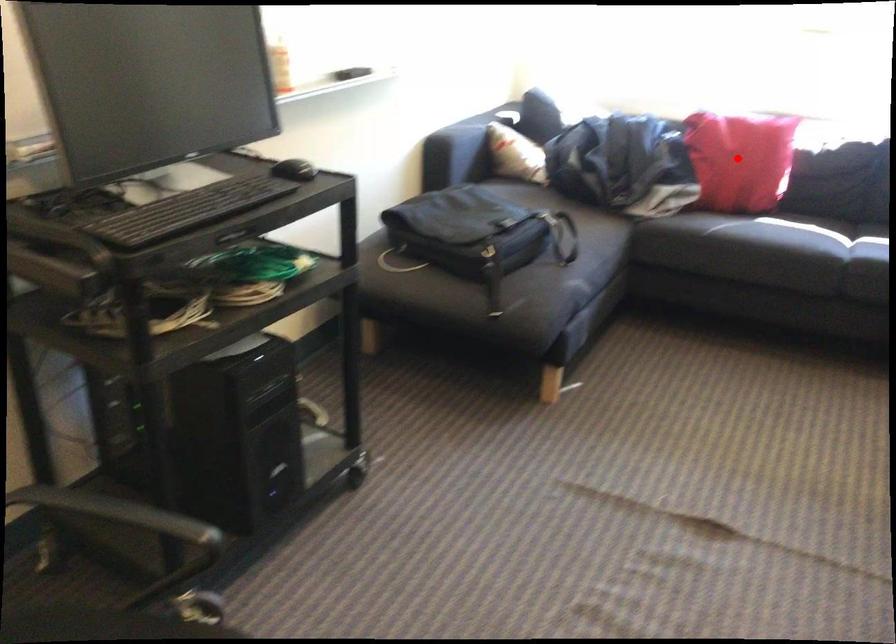
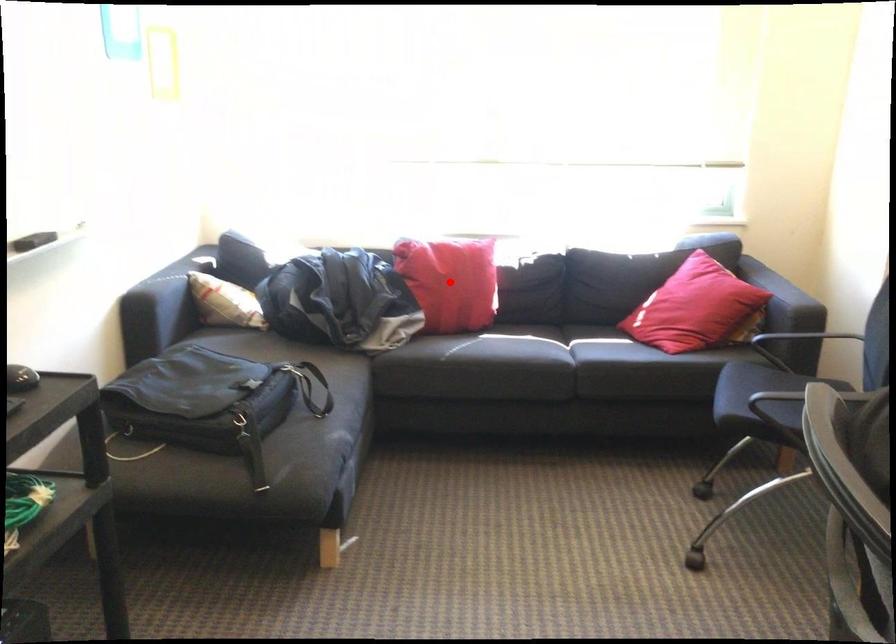
I am providing you with two images of the same scene from different viewpoints. A red point is marked on the first image and another point is marked on the second image. Are the points marked in image1 and image2 representing the same 3D position?

Yes